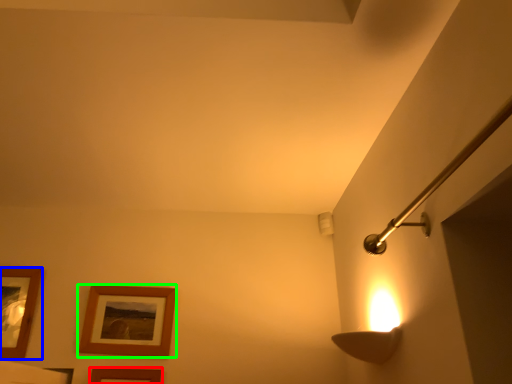
Question: Which object is the farthest from picture frame (highlighted by a red box)? Choose among these: picture frame (highlighted by a blue box) or picture frame (highlighted by a green box).

Choices:
 (A) picture frame
 (B) picture frame

Answer: (A)